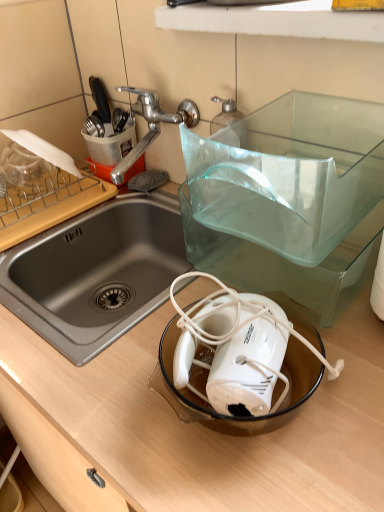
Question: From a real-world perspective, is silver metallic tap at upper left on wooden cutting board at left?

Choices:
 (A) yes
 (B) no

Answer: (A)

Question: Is silver metallic tap at upper left closer to camera compared to wooden cutting board at left?

Choices:
 (A) no
 (B) yes

Answer: (B)

Question: Does silver metallic tap at upper left appear on the left side of wooden cutting board at left?

Choices:
 (A) yes
 (B) no

Answer: (B)

Question: Would you say silver metallic tap at upper left is a long distance from wooden cutting board at left?

Choices:
 (A) yes
 (B) no

Answer: (B)

Question: Considering the relative sizes of silver metallic tap at upper left and wooden cutting board at left in the image provided, is silver metallic tap at upper left bigger than wooden cutting board at left?

Choices:
 (A) yes
 (B) no

Answer: (A)

Question: Does silver metallic tap at upper left have a greater width compared to wooden cutting board at left?

Choices:
 (A) no
 (B) yes

Answer: (B)

Question: Does wooden counter at center lie behind silver metallic tap at upper left?

Choices:
 (A) yes
 (B) no

Answer: (B)

Question: Does wooden counter at center appear on the left side of silver metallic tap at upper left?

Choices:
 (A) yes
 (B) no

Answer: (B)

Question: Does wooden counter at center have a larger size compared to silver metallic tap at upper left?

Choices:
 (A) yes
 (B) no

Answer: (A)

Question: Would you say wooden counter at center is outside silver metallic tap at upper left?

Choices:
 (A) yes
 (B) no

Answer: (A)

Question: From the image's perspective, is wooden counter at center above silver metallic tap at upper left?

Choices:
 (A) yes
 (B) no

Answer: (B)

Question: Is wooden counter at center surrounding silver metallic tap at upper left?

Choices:
 (A) yes
 (B) no

Answer: (B)

Question: Is wooden cutting board at left thinner than white plastic mixer at center?

Choices:
 (A) no
 (B) yes

Answer: (A)